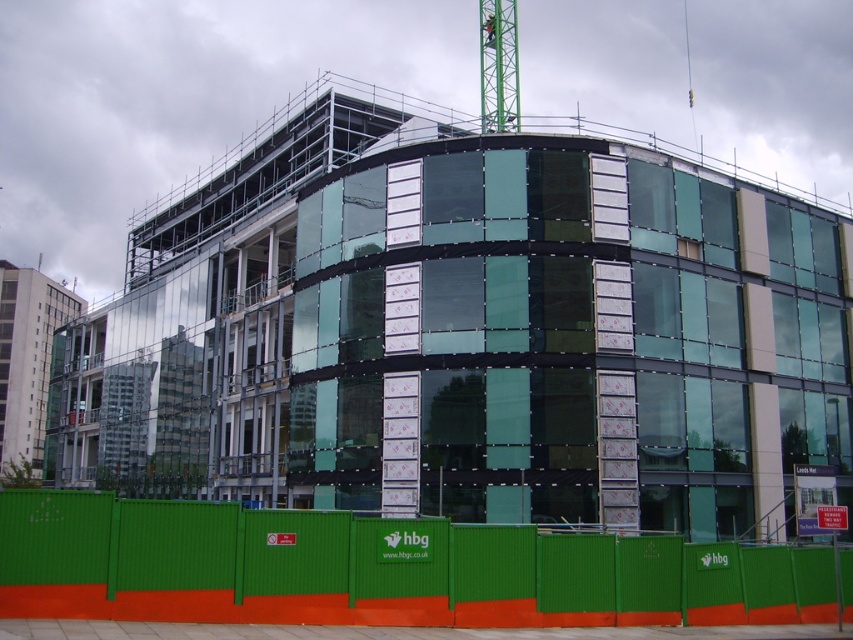
Who is taller, green glass building at center or green metallic crane at upper center?

green glass building at center is taller.

Measure the distance between green glass building at center and camera.

They are 141.85 feet apart.

Is point (276, 330) positioned before point (509, 128)?

Yes, it is in front of point (509, 128).

What are the coordinates of `green glass building at center` in the screenshot? It's located at (466, 326).

Is green glass building at center positioned in front of green corrugated plastic at lower center?

No, it is behind green corrugated plastic at lower center.

Based on the photo, can you confirm if green glass building at center is thinner than green corrugated plastic at lower center?

No.

What do you see at coordinates (466, 326) in the screenshot?
I see `green glass building at center` at bounding box center [466, 326].

In order to click on green glass building at center in this screenshot , I will do `click(466, 326)`.

Does green corrugated plastic at lower center have a greater width compared to green metallic crane at upper center?

Correct, the width of green corrugated plastic at lower center exceeds that of green metallic crane at upper center.

How distant is green corrugated plastic at lower center from green metallic crane at upper center?

green corrugated plastic at lower center is 62.30 meters from green metallic crane at upper center.

Who is more forward, (x=621, y=541) or (x=486, y=68)?

Point (x=621, y=541) is in front.

Where is `green corrugated plastic at lower center`? green corrugated plastic at lower center is located at coordinates (378, 570).